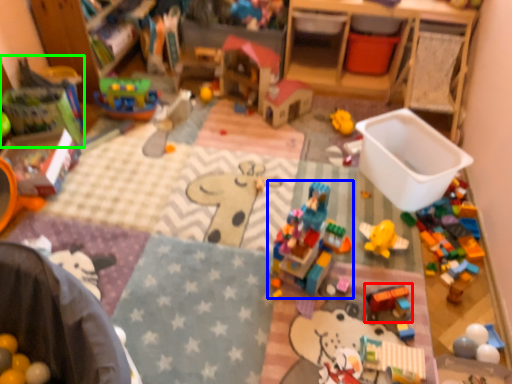
Question: Which is farther away from toy (highlighted by a red box)? toy (highlighted by a blue box) or toy (highlighted by a green box)?

Choices:
 (A) toy
 (B) toy

Answer: (B)